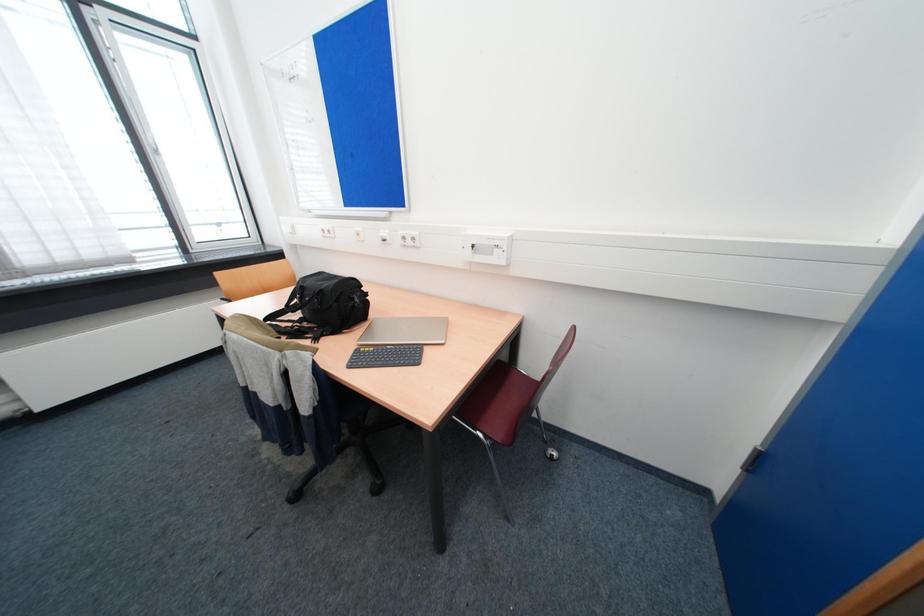
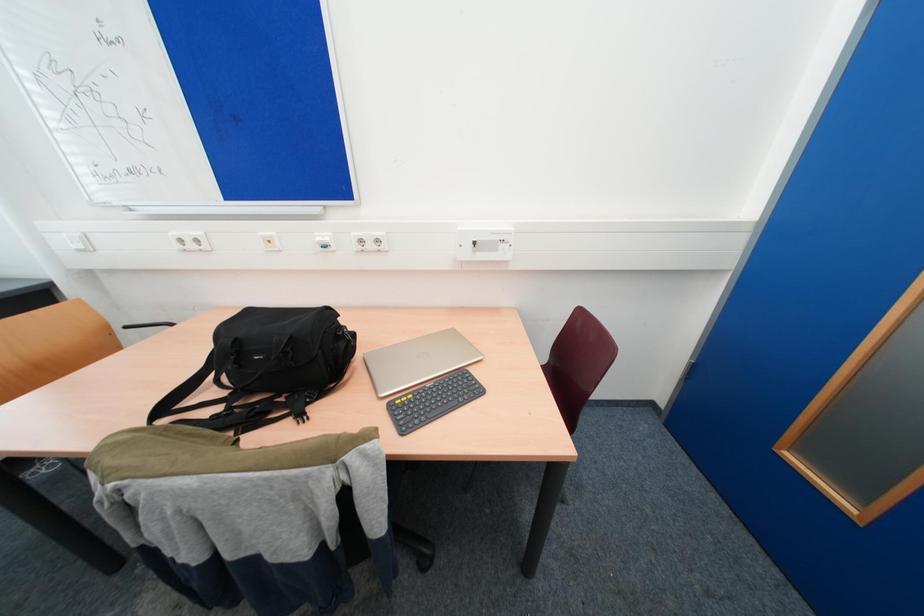
Question: The images are taken continuously from a first-person perspective. In which direction is your viewpoint rotating?

Choices:
 (A) Left
 (B) Right
 (C) Up
 (D) Down

Answer: (B)